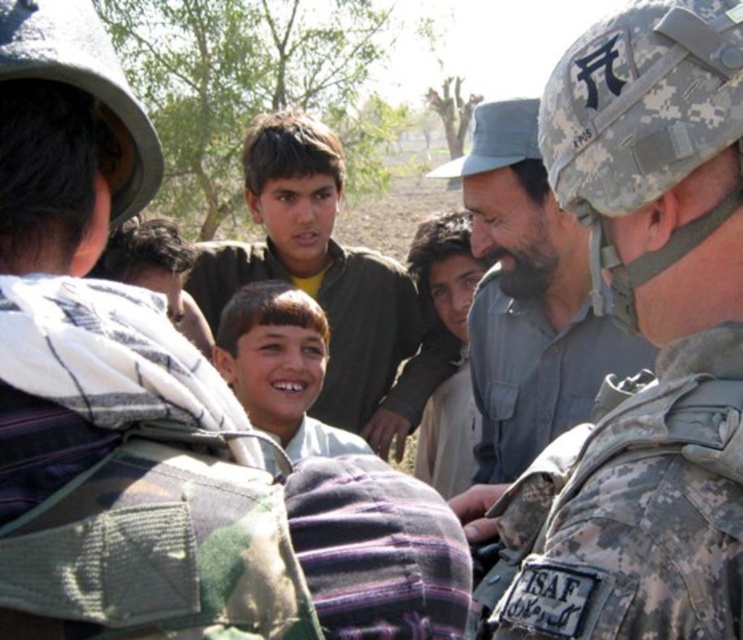
Question: Does camouflage uniform at center have a greater width compared to camouflage fabric military uniform at center?

Choices:
 (A) no
 (B) yes

Answer: (B)

Question: Which of these objects is positioned closest to the camouflage uniform at center?

Choices:
 (A) smooth brown face at center
 (B) camouflage fabric military uniform at center
 (C) gray matte shirt at center

Answer: (B)

Question: Is camouflage uniform at center to the left of camouflage fabric military uniform at center from the viewer's perspective?

Choices:
 (A) no
 (B) yes

Answer: (B)

Question: Which point appears farthest from the camera in this image?

Choices:
 (A) (736, 628)
 (B) (262, 349)
 (C) (626, 97)
 (D) (623, 348)

Answer: (B)

Question: Estimate the real-world distances between objects in this image. Which object is farther from the camouflage fabric military uniform at center?

Choices:
 (A) gray matte shirt at center
 (B) camouflage uniform at center

Answer: (A)

Question: Does gray matte shirt at center lie behind smooth brown face at center?

Choices:
 (A) yes
 (B) no

Answer: (B)